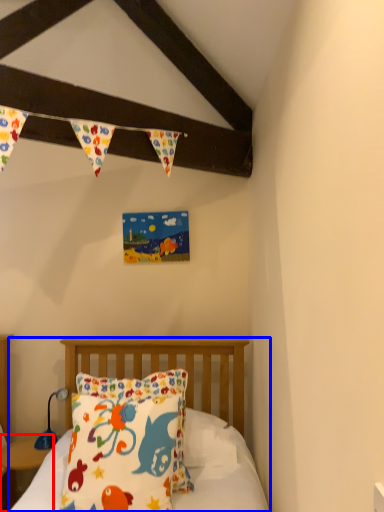
Question: Among these objects, which one is nearest to the camera, nightstand (highlighted by a red box) or bed (highlighted by a blue box)?

Choices:
 (A) nightstand
 (B) bed

Answer: (B)